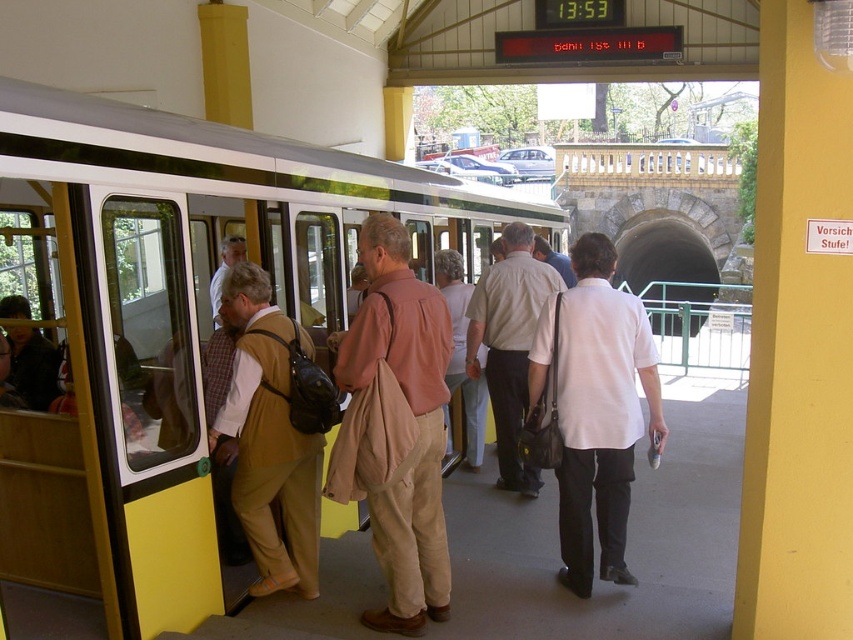
You are a fashion designer observing the people at the train station. You notice two individuals wearing a khaki fabric vest at center and a light beige fabric coat at center. Which clothing item appears to be the larger one?

The light beige fabric coat at center is larger than the khaki fabric vest at center.

You are a passenger on the platform and want to board the yellow matte train at center. There is a light beige fabric coat at center blocking your path. Can you walk around the coat to get to the train?

The yellow matte train at center is in front of the light beige fabric coat at center, meaning the coat is behind the train. Since the coat is behind the train, you can walk around it to reach the train.